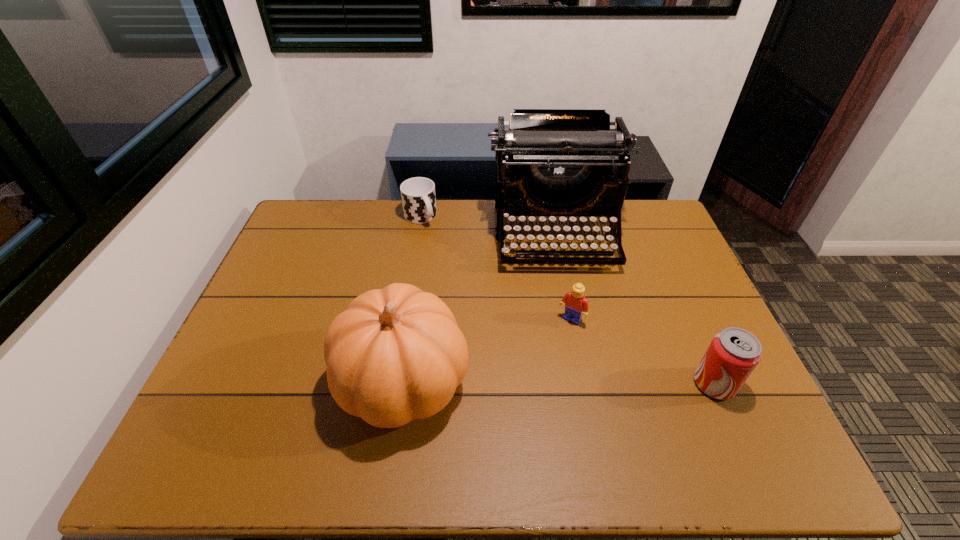
Where is `free space between the Lego and the third shortest object`? The image size is (960, 540). free space between the Lego and the third shortest object is located at coordinates (643, 352).

The height and width of the screenshot is (540, 960). I want to click on empty space that is in between the third tallest object and the fourth shortest object, so tap(559, 382).

Locate an element on the screen. free spot between the cup and the tallest object is located at coordinates [488, 226].

This screenshot has width=960, height=540. I want to click on free spot between the second tallest object and the tallest object, so click(479, 308).

Find the location of a particular element. empty location between the cup and the typewriter is located at coordinates (488, 226).

What are the coordinates of `unoccupied position between the Lego and the soda can` in the screenshot? It's located at (643, 352).

Identify the location of free spot between the third shortest object and the tallest object. (635, 309).

At what (x,y) coordinates should I click in order to perform the action: click on unoccupied position between the Lego and the second tallest object. Please return your answer as a coordinate pair (x, y). This screenshot has height=540, width=960. Looking at the image, I should click on (488, 351).

The height and width of the screenshot is (540, 960). I want to click on vacant area between the typewriter and the rightmost object, so click(635, 309).

This screenshot has width=960, height=540. I want to click on object that stands as the closest to the typewriter, so click(x=576, y=305).